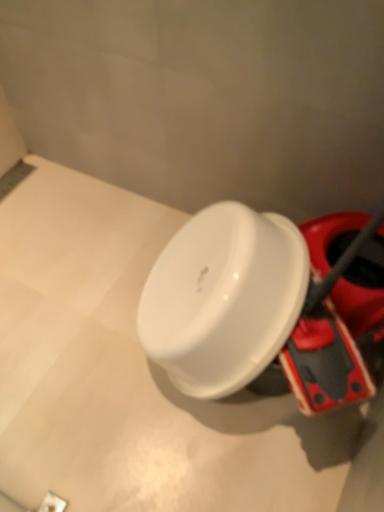
What do you see at coordinates (131, 374) in the screenshot? The height and width of the screenshot is (512, 384). I see `white glossy toilet at center` at bounding box center [131, 374].

Locate an element on the screen. This screenshot has height=512, width=384. white glossy toilet at center is located at coordinates (131, 374).

What is the approximate width of white glossy toilet at center?

14.95 inches.

Locate an element on the screen. white glossy toilet at center is located at coordinates (131, 374).